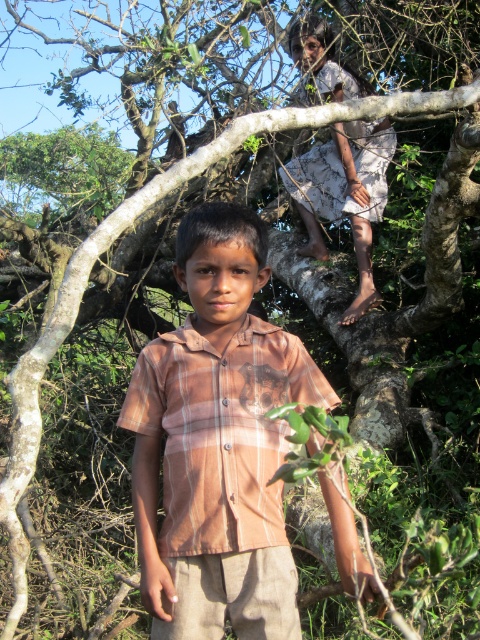
Is brown plaid shirt at center to the right of white cotton dress at upper center from the viewer's perspective?

In fact, brown plaid shirt at center is to the left of white cotton dress at upper center.

Does brown plaid shirt at center have a greater height compared to white cotton dress at upper center?

Incorrect, brown plaid shirt at center's height is not larger of white cotton dress at upper center's.

This screenshot has width=480, height=640. Identify the location of brown plaid shirt at center. (217, 442).